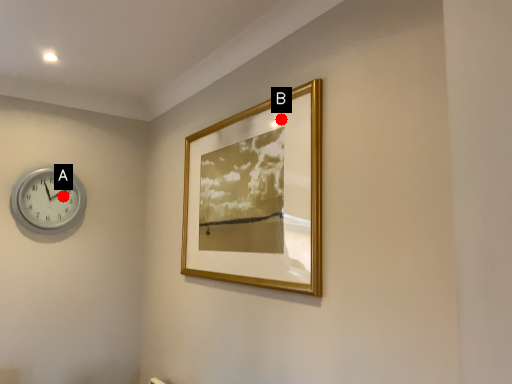
Question: Two points are circled on the image, labeled by A and B beside each circle. Which point is farther from the camera taking this photo?

Choices:
 (A) A is further
 (B) B is further

Answer: (A)